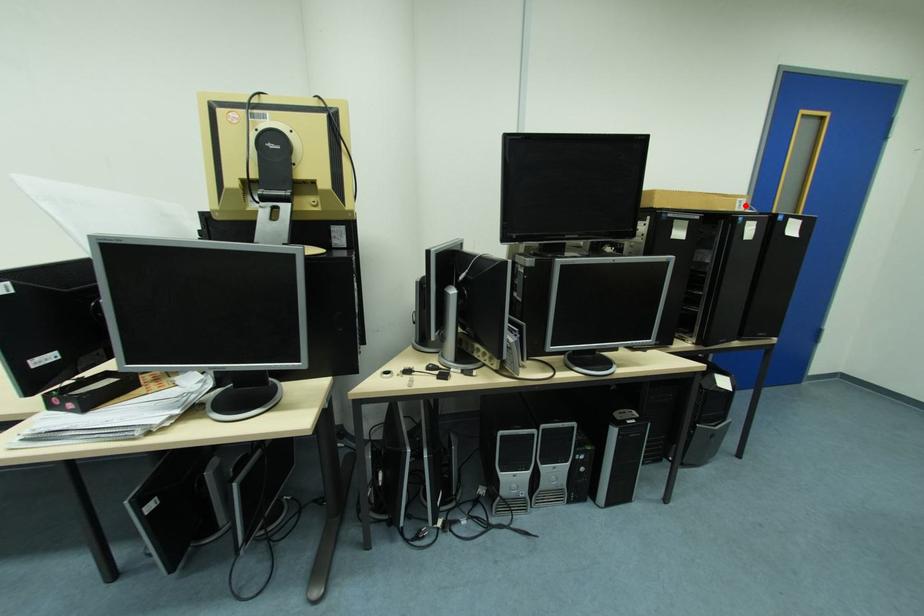
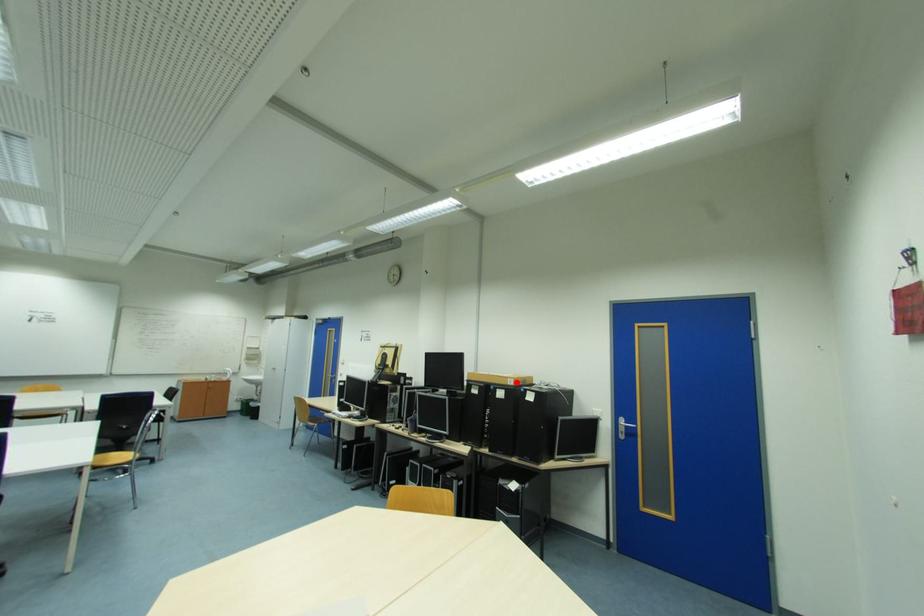
I am providing you with two images of the same scene from different viewpoints. A red point is marked on the first image and another point is marked on the second image. Are the points marked in image1 and image2 representing the same 3D position?

Yes